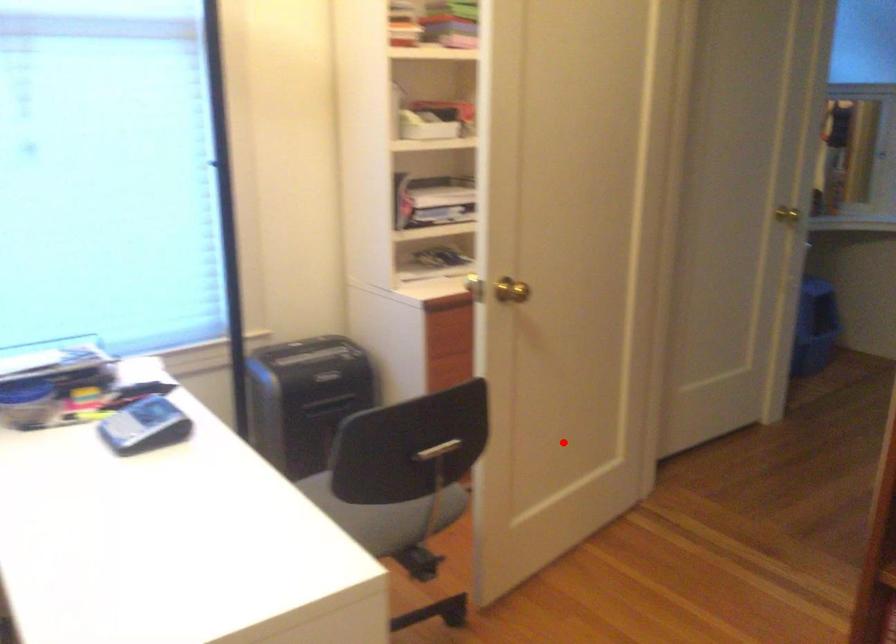
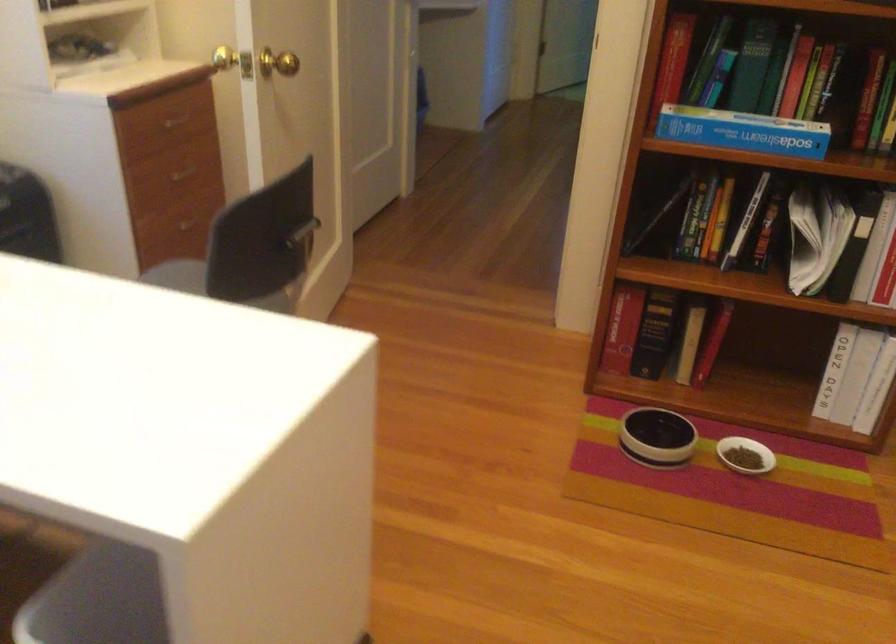
In the second image, find the point that corresponds to the highlighted location in the first image.

(304, 232)